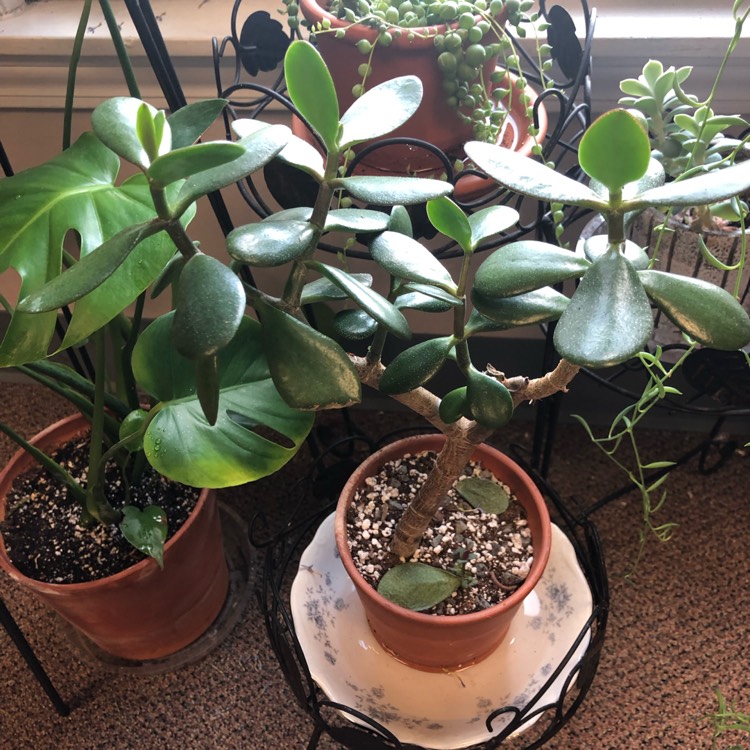
At what (x,y) coordinates should I click in order to perform the action: click on white wall. Please return your answer as a coordinate pair (x, y). This screenshot has width=750, height=750. Looking at the image, I should click on (45, 140).